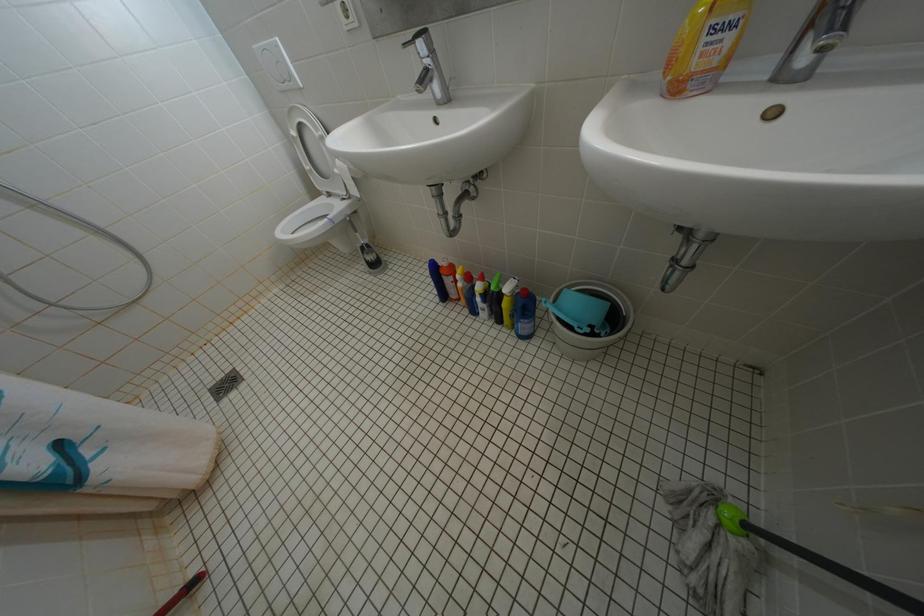
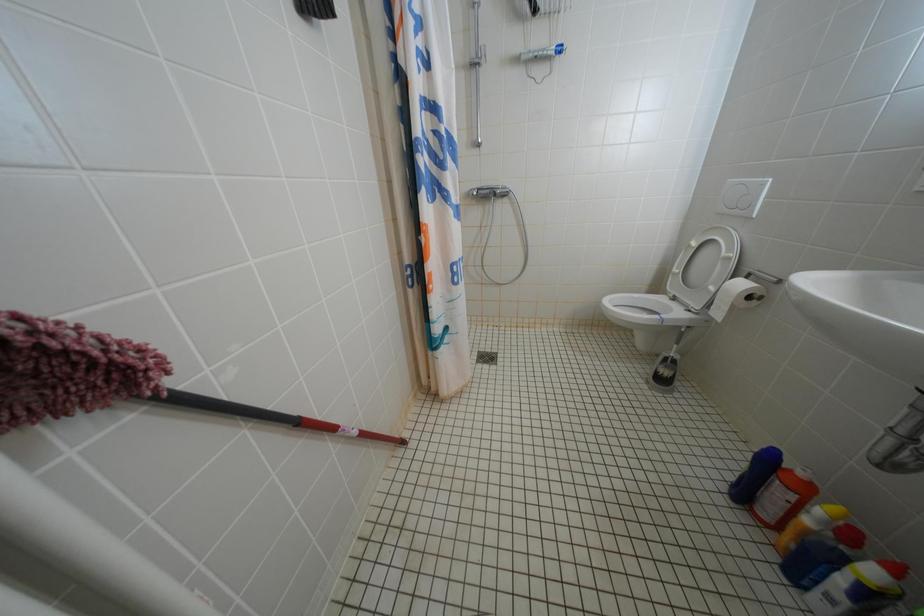
Question: Based on the continuous images, in which direction is the camera rotating? Reply with the corresponding letter.

Choices:
 (A) Left
 (B) Right
 (C) Up
 (D) Down

Answer: (A)